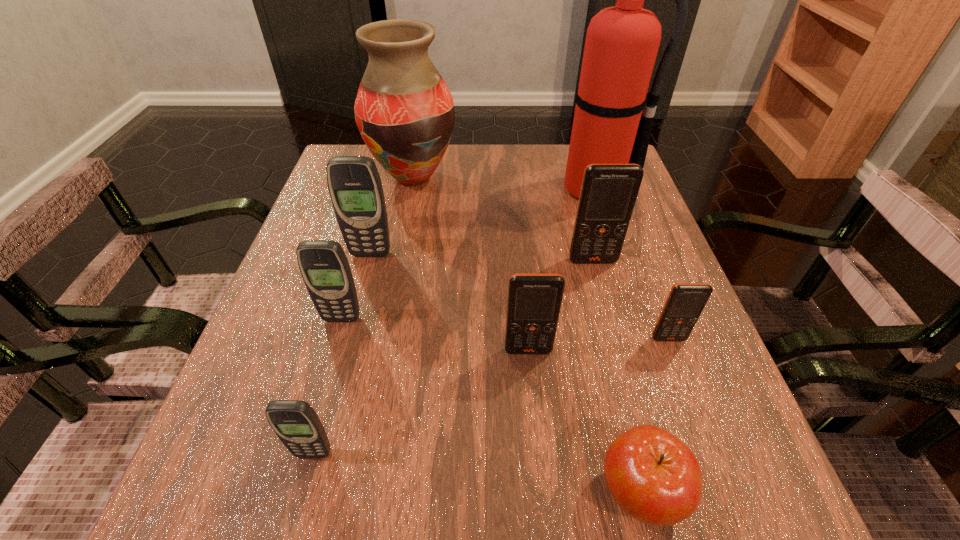
You are a GUI agent. You are given a task and a screenshot of the screen. Output one action in this format:
    pyautogui.click(x=<x>, y=<y>)
    Task: Click on the tallest object
    
    Given the screenshot: What is the action you would take?
    pyautogui.click(x=622, y=42)

In order to click on red fire extinguisher in this screenshot , I will do `click(622, 42)`.

I want to click on vase, so click(x=404, y=111).

I want to click on the farthest orange cellular telephone, so click(x=608, y=193).

Find the location of a particular element. The image size is (960, 540). the second orange cellular telephone from right to left is located at coordinates (608, 193).

Locate an element on the screen. the farthest gray cellular telephone is located at coordinates (354, 183).

Where is `the second smallest gray cellular telephone`? The height and width of the screenshot is (540, 960). the second smallest gray cellular telephone is located at coordinates (323, 264).

Locate an element on the screen. the fourth nearest cellular telephone is located at coordinates (x=323, y=264).

Where is `the nearest orange cellular telephone`? The height and width of the screenshot is (540, 960). the nearest orange cellular telephone is located at coordinates (534, 301).

The image size is (960, 540). In order to click on the seventh farthest object in this screenshot , I will do `click(534, 301)`.